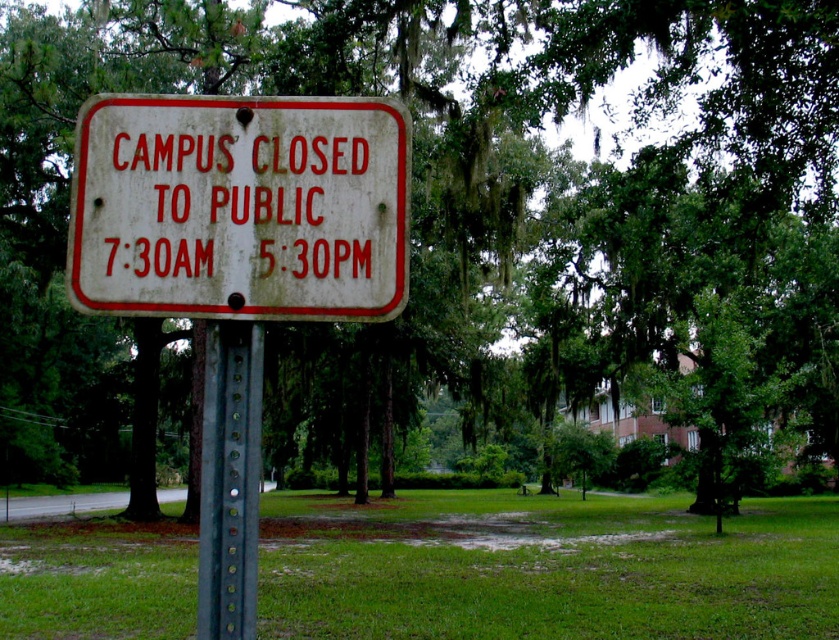
You are standing at the point closest to the signboard. Which coordinate point, point [334,275] or point [243,392], is farther away from you?

Point [334,275] is farther away from you because it is behind point [243,392].

You are a visitor trying to enter the campus and see the white weathered sign at center and the green metallic pole at center. Which object is shorter?

The white weathered sign at center is shorter than the green metallic pole at center.

You are a delivery driver trying to access the campus. You see the white weathered sign at center mounted on the green metallic pole at center. Based on the signboard information, can you enter the campus now?

The white weathered sign at center states that the campus is closed to the public from 730AM to 530PM. Since the current time is not provided, you cannot determine if the campus is open or closed at this moment.